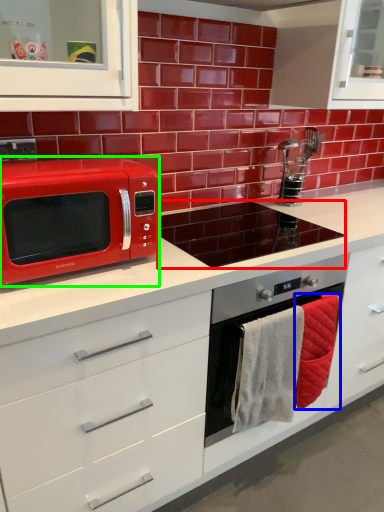
Question: Which is farther away from appliance (highlighted by a red box)? hand towel (highlighted by a blue box) or microwave oven (highlighted by a green box)?

Choices:
 (A) hand towel
 (B) microwave oven

Answer: (B)